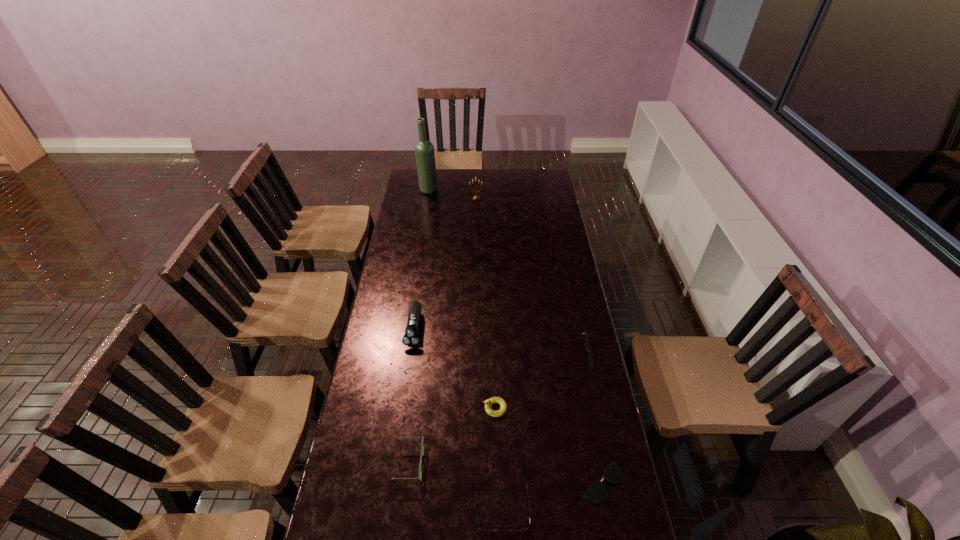
Locate an element on the screen. The width and height of the screenshot is (960, 540). wine bottle present at the left edge is located at coordinates (424, 150).

This screenshot has width=960, height=540. Find the location of `electric shaver at the left edge`. electric shaver at the left edge is located at coordinates (411, 338).

This screenshot has height=540, width=960. I want to click on object that is at the far left corner, so click(424, 150).

In the image, there is a desktop. Find the location of `free space at the left edge`. free space at the left edge is located at coordinates (422, 257).

Identify the location of vacant area that lies between the shortest spectacles and the wine bottle. click(x=516, y=336).

What are the coordinates of `free space between the duckling and the candelabrum` in the screenshot? It's located at [x=486, y=303].

Identify the location of free space between the wine bottle and the seventh tallest object. Image resolution: width=960 pixels, height=540 pixels. (466, 348).

Find the location of a particular element. empty location between the fifth farthest object and the seventh nearest object is located at coordinates (486, 303).

I want to click on free space between the leftmost spectacles and the duckling, so click(x=452, y=436).

This screenshot has width=960, height=540. I want to click on vacant space that is in between the electric shaver and the fourth nearest object, so click(x=455, y=368).